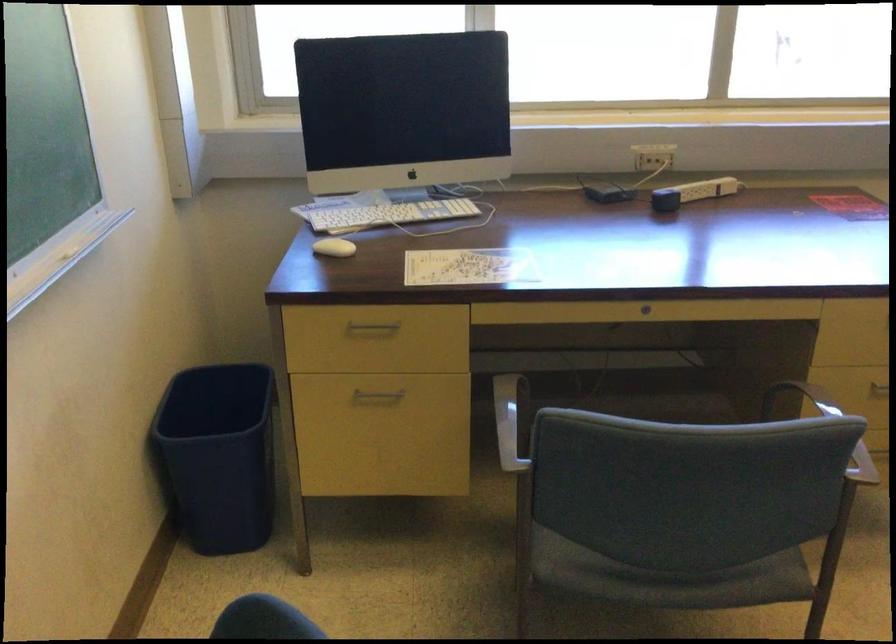
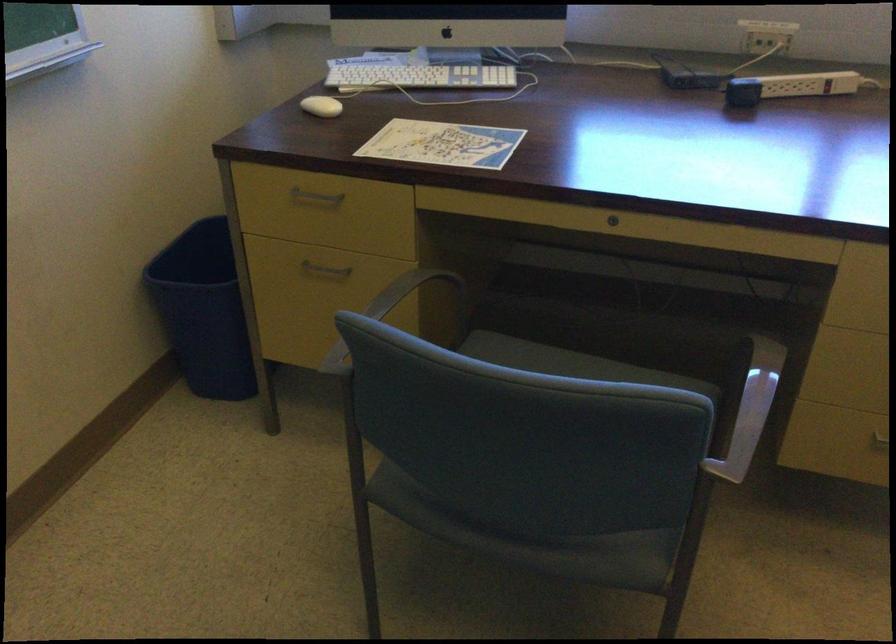
The point at (375, 393) is marked in the first image. Where is the corresponding point in the second image?

(324, 269)